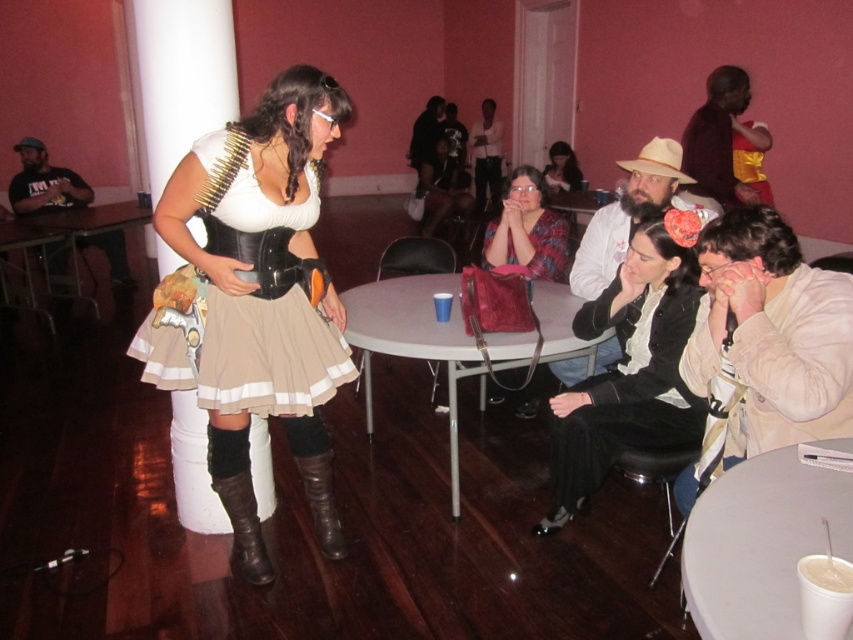
Question: Which of the following is the closest to the observer?

Choices:
 (A) (497, 140)
 (B) (614, 218)
 (C) (554, 161)

Answer: (B)

Question: Which point appears closest to the camera in this image?

Choices:
 (A) (254, 518)
 (B) (682, 444)
 (C) (689, 160)
 (D) (55, 253)

Answer: (B)

Question: Considering the relative positions of gray plastic table at center and printed fabric blouse at center in the image provided, where is gray plastic table at center located with respect to printed fabric blouse at center?

Choices:
 (A) above
 (B) below

Answer: (B)

Question: Which object is the farthest from the brown leather boot at lower left?

Choices:
 (A) white plastic cup at lower right
 (B) matte black shirt at center
 (C) velvet gold vest at upper right

Answer: (B)

Question: Is matte black dress at center thinner than wooden table at left?

Choices:
 (A) yes
 (B) no

Answer: (A)

Question: From the image, what is the correct spatial relationship of matte black skirt at center in relation to printed fabric blouse at center?

Choices:
 (A) below
 (B) above

Answer: (A)